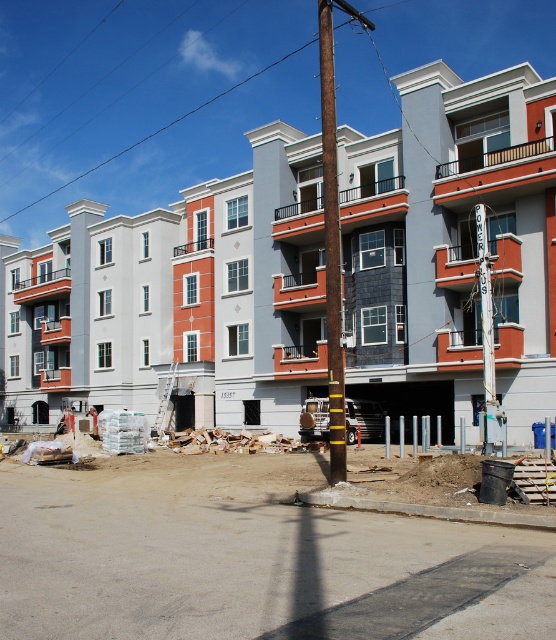
Question: Which of the following is the farthest from the observer?

Choices:
 (A) (345, 460)
 (B) (270, 496)
 (C) (71, 376)
 (D) (70, 429)

Answer: (C)

Question: Does white concrete building at upper center appear on the left side of rusty metal pole at center?

Choices:
 (A) no
 (B) yes

Answer: (B)

Question: Among these objects, which one is farthest from the camera?

Choices:
 (A) white hard hat at center
 (B) dirt at lower center

Answer: (A)

Question: Observing the image, what is the correct spatial positioning of rusty metal pole at center in reference to white fabric construction worker at center?

Choices:
 (A) above
 (B) below

Answer: (A)

Question: Which object appears farthest from the camera in this image?

Choices:
 (A) white concrete building at upper center
 (B) dirt at lower center
 (C) rusty metal pole at center

Answer: (A)

Question: Is rusty metal pole at center above white hard hat at center?

Choices:
 (A) yes
 (B) no

Answer: (A)